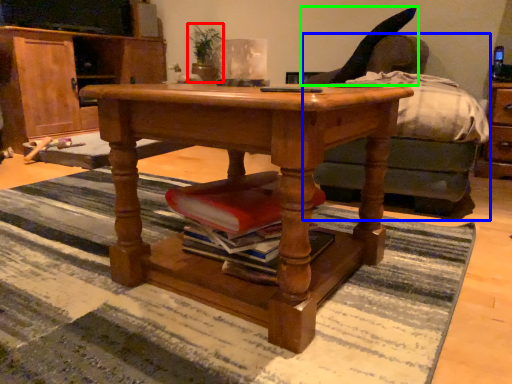
Question: Considering the real-world distances, which object is closest to houseplant (highlighted by a red box)? studio couch (highlighted by a blue box) or swivel chair (highlighted by a green box).

Choices:
 (A) studio couch
 (B) swivel chair

Answer: (B)